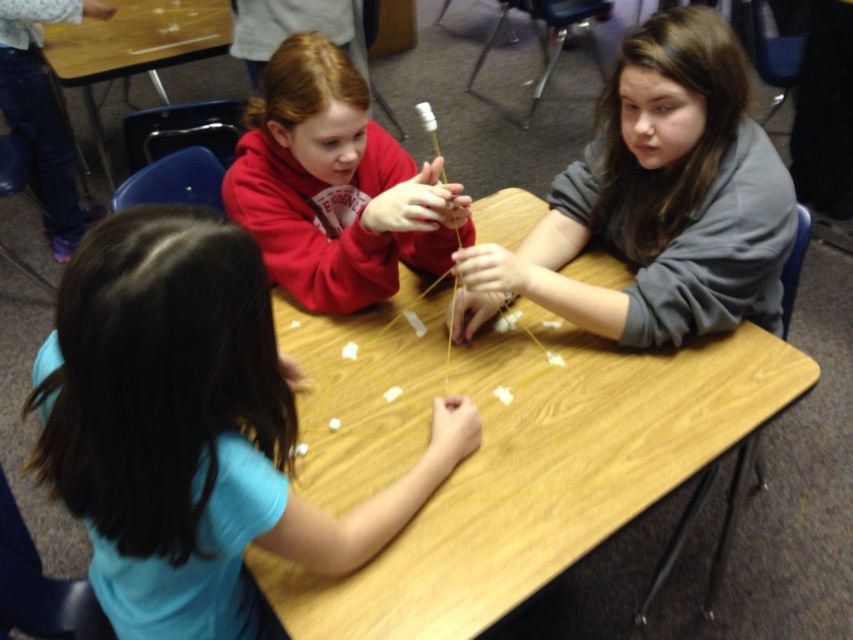
Can you confirm if blue matte shirt at center is wider than gray matte sweater at upper right?

In fact, blue matte shirt at center might be narrower than gray matte sweater at upper right.

Is point (123, 240) farther from camera compared to point (585, 323)?

No, it is not.

Find the location of a particular element. The image size is (853, 640). blue matte shirt at center is located at coordinates (193, 429).

Is wooden table at center bigger than matte red hoodie at upper center?

Yes, wooden table at center is bigger than matte red hoodie at upper center.

Is wooden table at center smaller than matte red hoodie at upper center?

No.

This screenshot has width=853, height=640. Describe the element at coordinates (544, 474) in the screenshot. I see `wooden table at center` at that location.

This screenshot has height=640, width=853. Identify the location of wooden table at center. (544, 474).

Is gray matte sweater at upper right below matte red hoodie at upper center?

Yes, gray matte sweater at upper right is below matte red hoodie at upper center.

Between gray matte sweater at upper right and matte red hoodie at upper center, which one appears on the left side from the viewer's perspective?

matte red hoodie at upper center is more to the left.

Where is `gray matte sweater at upper right`? Image resolution: width=853 pixels, height=640 pixels. gray matte sweater at upper right is located at coordinates (657, 200).